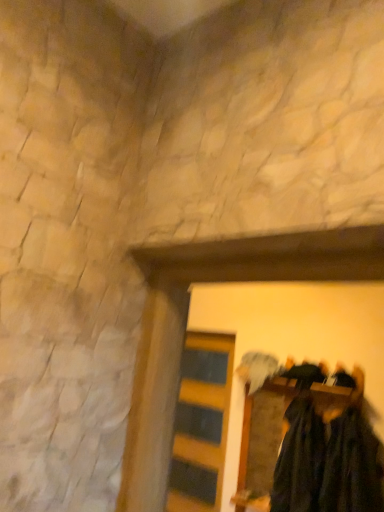
The width and height of the screenshot is (384, 512). Describe the element at coordinates (299, 459) in the screenshot. I see `dark green fabric at lower right, the first clothing in the left-to-right sequence` at that location.

The width and height of the screenshot is (384, 512). What do you see at coordinates (352, 466) in the screenshot?
I see `dark green fuzzy sweater at lower right, the 2th clothing positioned from the left` at bounding box center [352, 466].

What do you see at coordinates (201, 423) in the screenshot? I see `yellow striped wood at center` at bounding box center [201, 423].

Identify the location of yellow striped wood at center. The image size is (384, 512). click(x=201, y=423).

You are a GUI agent. You are given a task and a screenshot of the screen. Output one action in this format:
    pyautogui.click(x=<x>, y=<y>)
    Task: Click on the dark green fabric at lower right, the first clothing in the left-to-right sequence
    
    Given the screenshot: What is the action you would take?
    pyautogui.click(x=299, y=459)

Between point (278, 463) and point (303, 490), which one is positioned in front?

Positioned in front is point (303, 490).

Is dark green fabric at lower right, the first clothing in the left-to-right sequence, placed right next to dark green fabric at center?

Yes, dark green fabric at lower right, the first clothing in the left-to-right sequence, is next to dark green fabric at center.

Is dark green fabric at lower right, the second clothing when ordered from right to left, wider than dark green fabric at center?

Correct, the width of dark green fabric at lower right, the second clothing when ordered from right to left, exceeds that of dark green fabric at center.

This screenshot has width=384, height=512. I want to click on clothing in front of the dark green fabric at center, so click(x=352, y=466).

Looking at their sizes, would you say dark green fuzzy sweater at lower right, arranged as the 1th clothing when viewed from the right, is wider or thinner than dark green fabric at center?

dark green fuzzy sweater at lower right, arranged as the 1th clothing when viewed from the right, is thinner than dark green fabric at center.

Is dark green fuzzy sweater at lower right, the 2th clothing positioned from the left, turned away from dark green fabric at center?

Yes, dark green fuzzy sweater at lower right, the 2th clothing positioned from the left, is facing away from dark green fabric at center.

Can you confirm if dark green fuzzy sweater at lower right, arranged as the 1th clothing when viewed from the right, is shorter than dark green fabric at center?

Correct, dark green fuzzy sweater at lower right, arranged as the 1th clothing when viewed from the right, is not as tall as dark green fabric at center.

Which is more to the right, dark green fabric at center or dark green fuzzy sweater at lower right, arranged as the 1th clothing when viewed from the right?

Positioned to the right is dark green fuzzy sweater at lower right, arranged as the 1th clothing when viewed from the right.

Would you say dark green fabric at center is outside dark green fuzzy sweater at lower right, arranged as the 1th clothing when viewed from the right?

Yes.

Is dark green fabric at center aimed at dark green fuzzy sweater at lower right, arranged as the 1th clothing when viewed from the right?

No, dark green fabric at center is not aimed at dark green fuzzy sweater at lower right, arranged as the 1th clothing when viewed from the right.

From a real-world perspective, is dark green fabric at center on dark green fuzzy sweater at lower right, arranged as the 1th clothing when viewed from the right?

Yes.

Can you confirm if dark green fabric at lower right, the second clothing when ordered from right to left, is smaller than yellow striped wood at center?

Actually, dark green fabric at lower right, the second clothing when ordered from right to left, might be larger than yellow striped wood at center.

Considering the positions of points (301, 461) and (191, 357), is point (301, 461) farther from camera compared to point (191, 357)?

No, (301, 461) is closer to viewer.

Which of these two, dark green fabric at lower right, the second clothing when ordered from right to left, or yellow striped wood at center, is thinner?

yellow striped wood at center.

From the image's perspective, which is above, dark green fabric at lower right, the first clothing in the left-to-right sequence, or yellow striped wood at center?

dark green fabric at lower right, the first clothing in the left-to-right sequence, appears higher in the image.

What's the angular difference between dark green fuzzy sweater at lower right, the 2th clothing positioned from the left, and dark green fabric at lower right, the second clothing when ordered from right to left,'s facing directions?

dark green fuzzy sweater at lower right, the 2th clothing positioned from the left, and dark green fabric at lower right, the second clothing when ordered from right to left, are facing 4.43e-05 degrees away from each other.

Based on the photo, measure the distance from dark green fuzzy sweater at lower right, arranged as the 1th clothing when viewed from the right, to dark green fabric at lower right, the second clothing when ordered from right to left.

They are 19.55 centimeters apart.

Looking at this image, considering the relative sizes of dark green fuzzy sweater at lower right, the 2th clothing positioned from the left, and dark green fabric at lower right, the second clothing when ordered from right to left, in the image provided, is dark green fuzzy sweater at lower right, the 2th clothing positioned from the left, wider than dark green fabric at lower right, the second clothing when ordered from right to left,?

Incorrect, the width of dark green fuzzy sweater at lower right, the 2th clothing positioned from the left, does not surpass that of dark green fabric at lower right, the second clothing when ordered from right to left.

Is dark green fuzzy sweater at lower right, the 2th clothing positioned from the left, turned away from dark green fabric at lower right, the first clothing in the left-to-right sequence?

dark green fuzzy sweater at lower right, the 2th clothing positioned from the left, is not turned away from dark green fabric at lower right, the first clothing in the left-to-right sequence.

Is yellow striped wood at center far from dark green fabric at lower right, the first clothing in the left-to-right sequence?

yellow striped wood at center is near dark green fabric at lower right, the first clothing in the left-to-right sequence, not far away.

Is yellow striped wood at center bigger or smaller than dark green fabric at lower right, the second clothing when ordered from right to left?

In the image, yellow striped wood at center appears to be smaller than dark green fabric at lower right, the second clothing when ordered from right to left.

Can you tell me how much yellow striped wood at center and dark green fabric at lower right, the second clothing when ordered from right to left, differ in facing direction?

0.213 degrees separate the facing orientations of yellow striped wood at center and dark green fabric at lower right, the second clothing when ordered from right to left.

From a real-world perspective, between dark green fuzzy sweater at lower right, the 2th clothing positioned from the left, and yellow striped wood at center, who is vertically higher?

dark green fuzzy sweater at lower right, the 2th clothing positioned from the left, from a real-world perspective.

Between dark green fuzzy sweater at lower right, arranged as the 1th clothing when viewed from the right, and yellow striped wood at center, which one has smaller size?

With smaller size is yellow striped wood at center.

Starting from the yellow striped wood at center, which clothing is the 2nd one in front? Please provide its 2D coordinates.

[(352, 466)]

Which is behind, dark green fuzzy sweater at lower right, the 2th clothing positioned from the left, or yellow striped wood at center?

yellow striped wood at center is more distant.

The image size is (384, 512). I want to click on laundry above the dark green fabric at lower right, the second clothing when ordered from right to left (from the image's perspective), so click(327, 460).

Locate an element on the screen. This screenshot has height=512, width=384. laundry behind the dark green fuzzy sweater at lower right, the 2th clothing positioned from the left is located at coordinates (327, 460).

Which object lies nearer to the anchor point yellow striped wood at center, dark green fabric at center or dark green fuzzy sweater at lower right, the 2th clothing positioned from the left?

dark green fabric at center is closer to yellow striped wood at center.

Based on their spatial positions, is dark green fabric at lower right, the second clothing when ordered from right to left, or yellow striped wood at center further from dark green fuzzy sweater at lower right, the 2th clothing positioned from the left?

The object further to dark green fuzzy sweater at lower right, the 2th clothing positioned from the left, is yellow striped wood at center.

Considering their positions, is yellow striped wood at center positioned closer to dark green fabric at lower right, the first clothing in the left-to-right sequence, than dark green fuzzy sweater at lower right, arranged as the 1th clothing when viewed from the right?

Among the two, dark green fuzzy sweater at lower right, arranged as the 1th clothing when viewed from the right, is located nearer to dark green fabric at lower right, the first clothing in the left-to-right sequence.

Considering their positions, is dark green fabric at lower right, the second clothing when ordered from right to left, positioned closer to yellow striped wood at center than dark green fabric at center?

dark green fabric at lower right, the second clothing when ordered from right to left, is closer to yellow striped wood at center.

Based on their spatial positions, is yellow striped wood at center or dark green fabric at center further from dark green fuzzy sweater at lower right, arranged as the 1th clothing when viewed from the right?

yellow striped wood at center lies further to dark green fuzzy sweater at lower right, arranged as the 1th clothing when viewed from the right, than the other object.

Looking at the image, which one is located closer to dark green fabric at center, yellow striped wood at center or dark green fabric at lower right, the second clothing when ordered from right to left?

Based on the image, dark green fabric at lower right, the second clothing when ordered from right to left, appears to be nearer to dark green fabric at center.

From the image, which object appears to be nearer to dark green fabric at center, yellow striped wood at center or dark green fuzzy sweater at lower right, the 2th clothing positioned from the left?

Among the two, dark green fuzzy sweater at lower right, the 2th clothing positioned from the left, is located nearer to dark green fabric at center.

Based on their spatial positions, is dark green fabric at lower right, the second clothing when ordered from right to left, or dark green fabric at center further from dark green fuzzy sweater at lower right, the 2th clothing positioned from the left?

dark green fabric at lower right, the second clothing when ordered from right to left, lies further to dark green fuzzy sweater at lower right, the 2th clothing positioned from the left, than the other object.

Where is `clothing located between dark green fabric at center and yellow striped wood at center in the depth direction`? clothing located between dark green fabric at center and yellow striped wood at center in the depth direction is located at coordinates (299, 459).

The image size is (384, 512). I want to click on clothing between dark green fuzzy sweater at lower right, the 2th clothing positioned from the left, and yellow striped wood at center from front to back, so click(299, 459).

Image resolution: width=384 pixels, height=512 pixels. I want to click on clothing between dark green fabric at center and dark green fuzzy sweater at lower right, arranged as the 1th clothing when viewed from the right, so click(299, 459).

Find the location of `laundry located between dark green fuzzy sweater at lower right, the 2th clothing positioned from the left, and yellow striped wood at center in the depth direction`. laundry located between dark green fuzzy sweater at lower right, the 2th clothing positioned from the left, and yellow striped wood at center in the depth direction is located at coordinates (327, 460).